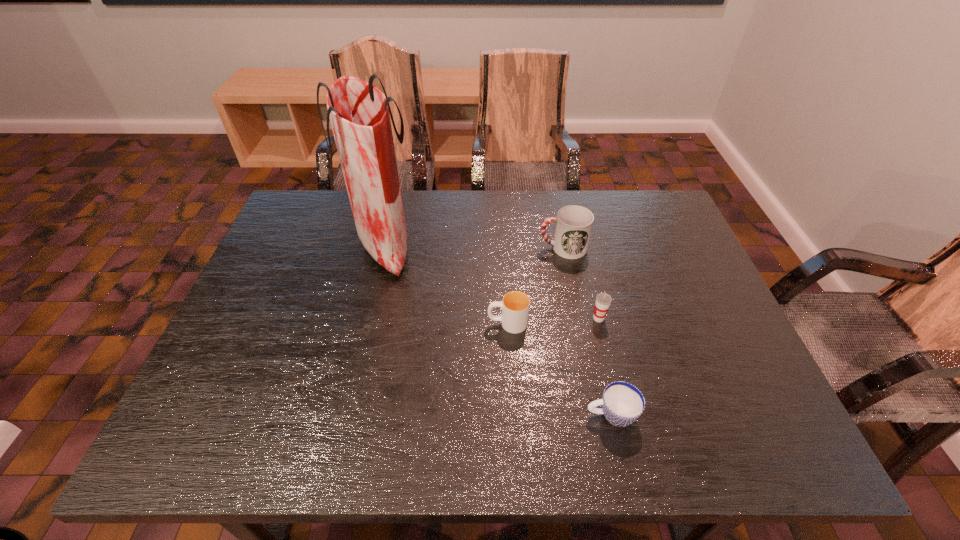
Image resolution: width=960 pixels, height=540 pixels. In the image, there is a desktop. In order to click on free region at the far edge in this screenshot , I will do `click(531, 216)`.

This screenshot has height=540, width=960. I want to click on blank space at the near edge of the desktop, so click(x=299, y=447).

Where is `free space at the left edge`? Image resolution: width=960 pixels, height=540 pixels. free space at the left edge is located at coordinates click(265, 312).

You are a GUI agent. You are given a task and a screenshot of the screen. Output one action in this format:
    pyautogui.click(x=<x>, y=<y>)
    Task: Click on the vacant space at the right edge
    Image resolution: width=960 pixels, height=540 pixels.
    Given the screenshot: What is the action you would take?
    pyautogui.click(x=738, y=361)

The height and width of the screenshot is (540, 960). I want to click on vacant region at the far left corner, so point(288,212).

Identify the location of vacant region at the far right corner. The image size is (960, 540). (635, 202).

Where is `empty space that is in between the grocery bag and the farthest cup`? The height and width of the screenshot is (540, 960). empty space that is in between the grocery bag and the farthest cup is located at coordinates (x=473, y=246).

Identify the location of free space between the tallest object and the nearest object. The width and height of the screenshot is (960, 540). (498, 330).

Find the location of a particular element. The width and height of the screenshot is (960, 540). free space between the farthest cup and the leftmost object is located at coordinates (473, 246).

At what (x,y) coordinates should I click in order to perform the action: click on empty space that is in between the farthest cup and the leftmost cup. Please return your answer as a coordinate pair (x, y). Looking at the image, I should click on (535, 286).